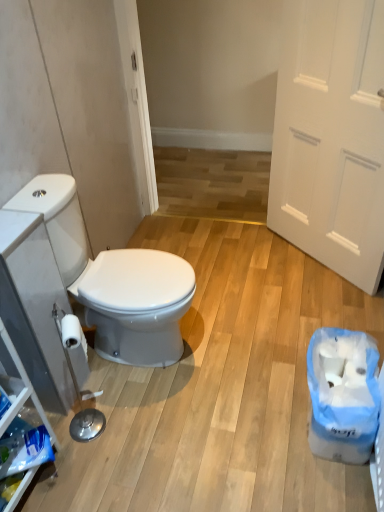
This screenshot has height=512, width=384. What do you see at coordinates (342, 396) in the screenshot? I see `blue plastic bag at lower right` at bounding box center [342, 396].

What is the approximate height of blue plastic bag at lower right?

The height of blue plastic bag at lower right is 11.28 inches.

Locate an element on the screen. The image size is (384, 512). white glossy toilet seat at left is located at coordinates (114, 280).

Could you tell me if white matte door at right is turned towards blue plastic bag at lower right?

No, white matte door at right is not oriented towards blue plastic bag at lower right.

Which is behind, white matte door at right or blue plastic bag at lower right?

white matte door at right is behind.

Considering the relative sizes of white matte door at right and blue plastic bag at lower right in the image provided, is white matte door at right thinner than blue plastic bag at lower right?

Yes, white matte door at right is thinner than blue plastic bag at lower right.

Is white glossy toilet seat at left positioned with its back to white matte door at right?

No, white glossy toilet seat at left is not facing away from white matte door at right.

Which object is further away from the camera, white glossy toilet seat at left or white matte door at right?

white matte door at right is further away from the camera.

From the image's perspective, who appears lower, white glossy toilet seat at left or white matte door at right?

white glossy toilet seat at left appears lower in the image.

From a real-world perspective, between white glossy toilet seat at left and white matte door at right, who is vertically higher?

white matte door at right is physically above.

In the image, is white glossy toilet seat at left positioned in front of or behind blue plastic bag at lower right?

Visually, white glossy toilet seat at left is located in front of blue plastic bag at lower right.

Would you say white glossy toilet seat at left is a long distance from blue plastic bag at lower right?

No, white glossy toilet seat at left is in close proximity to blue plastic bag at lower right.

Does white glossy toilet seat at left have a larger size compared to blue plastic bag at lower right?

Yes, white glossy toilet seat at left is bigger than blue plastic bag at lower right.

Can you tell me how much blue plastic bag at lower right and white glossy toilet seat at left differ in facing direction?

The angular difference between blue plastic bag at lower right and white glossy toilet seat at left is 176 degrees.

Is blue plastic bag at lower right positioned far away from white glossy toilet seat at left?

blue plastic bag at lower right is near white glossy toilet seat at left, not far away.

Looking at the image, does blue plastic bag at lower right seem bigger or smaller compared to white glossy toilet seat at left?

Clearly, blue plastic bag at lower right is smaller in size than white glossy toilet seat at left.

Is blue plastic bag at lower right situated inside white glossy toilet seat at left or outside?

blue plastic bag at lower right is outside white glossy toilet seat at left.

In terms of width, does blue plastic bag at lower right look wider or thinner when compared to white matte door at right?

In the image, blue plastic bag at lower right appears to be wider than white matte door at right.

From a real-world perspective, relative to white matte door at right, is blue plastic bag at lower right vertically above or below?

In terms of real-world spatial position, blue plastic bag at lower right is below white matte door at right.

Where is `door above the blue plastic bag at lower right (from a real-world perspective)`? door above the blue plastic bag at lower right (from a real-world perspective) is located at coordinates (331, 137).

Considering the positions of objects white matte door at right and white glossy toilet seat at left in the image provided, who is more to the right, white matte door at right or white glossy toilet seat at left?

white matte door at right is more to the right.

Is white matte door at right surrounding white glossy toilet seat at left?

Actually, white glossy toilet seat at left is outside white matte door at right.

From a real-world perspective, who is located higher, white matte door at right or white glossy toilet seat at left?

From a 3D spatial view, white matte door at right is above.

Could you tell me if white matte door at right is facing white glossy toilet seat at left?

Yes, white matte door at right is turned towards white glossy toilet seat at left.

Identify the location of door above the blue plastic bag at lower right (from the image's perspective). Image resolution: width=384 pixels, height=512 pixels. point(331,137).

This screenshot has width=384, height=512. Identify the location of sit located in front of the white matte door at right. (114, 280).

Estimate the real-world distances between objects in this image. Which object is closer to white glossy toilet seat at left, white matte door at right or blue plastic bag at lower right?

blue plastic bag at lower right is positioned closer to the anchor white glossy toilet seat at left.

When comparing their distances from white glossy toilet seat at left, does blue plastic bag at lower right or white matte door at right seem closer?

The object closer to white glossy toilet seat at left is blue plastic bag at lower right.

Considering their positions, is white matte door at right positioned closer to blue plastic bag at lower right than white glossy toilet seat at left?

The object closer to blue plastic bag at lower right is white glossy toilet seat at left.

Looking at the image, which one is located further to white matte door at right, white glossy toilet seat at left or blue plastic bag at lower right?

white glossy toilet seat at left.

Based on their spatial positions, is blue plastic bag at lower right or white glossy toilet seat at left further from white matte door at right?

Based on the image, white glossy toilet seat at left appears to be further to white matte door at right.

Based on their spatial positions, is white glossy toilet seat at left or white matte door at right further from blue plastic bag at lower right?

white matte door at right lies further to blue plastic bag at lower right than the other object.

In order to click on recycling bin situated between white glossy toilet seat at left and white matte door at right from left to right in this screenshot , I will do `click(342, 396)`.